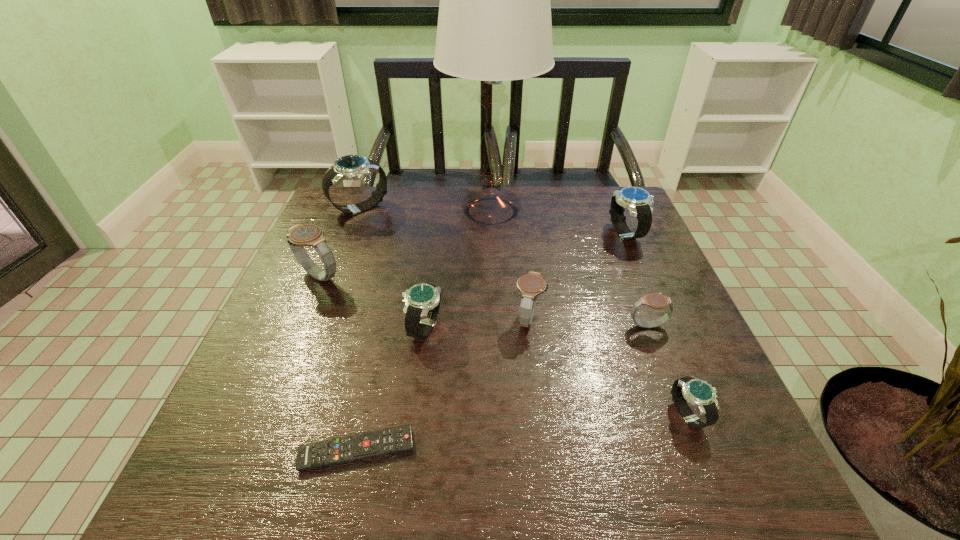
Find the location of a particular element. Image resolution: width=960 pixels, height=540 pixels. free spot between the second biggest silver watch and the shortest object is located at coordinates (492, 342).

Image resolution: width=960 pixels, height=540 pixels. I want to click on empty space between the rightmost gray watch and the second gray watch from right to left, so click(588, 322).

You are a GUI agent. You are given a task and a screenshot of the screen. Output one action in this format:
    pyautogui.click(x=<x>, y=<y>)
    Task: Click on the free space between the fifth watch from right to left and the fourth watch from right to left
    The width and height of the screenshot is (960, 540).
    Given the screenshot: What is the action you would take?
    pyautogui.click(x=476, y=323)

You are a GUI agent. You are given a task and a screenshot of the screen. Output one action in this format:
    pyautogui.click(x=<x>, y=<y>)
    Task: Click on the free space between the shortest object and the second biggest gray watch
    
    Given the screenshot: What is the action you would take?
    pyautogui.click(x=443, y=384)

Locate an element on the screen. unoccupied position between the nearest silver watch and the table lamp is located at coordinates (x=590, y=313).

In order to click on object that is the fourth closest to the nearest watch in this screenshot , I will do `click(422, 301)`.

Image resolution: width=960 pixels, height=540 pixels. Identify the location of object that can be found as the seventh closest to the biggest gray watch. (639, 202).

Choose which watch is the second nearest neighbor to the tallest object. Please provide its 2D coordinates. Your answer should be formatted as a tuple, i.e. [(x, y)], where the tuple contains the x and y coordinates of a point satisfying the conditions above.

[(639, 202)]

Identify the location of the second closest watch to the biggest silver watch. (422, 301).

Identify the location of silver watch that is the closest to the third smallest silver watch. (699, 393).